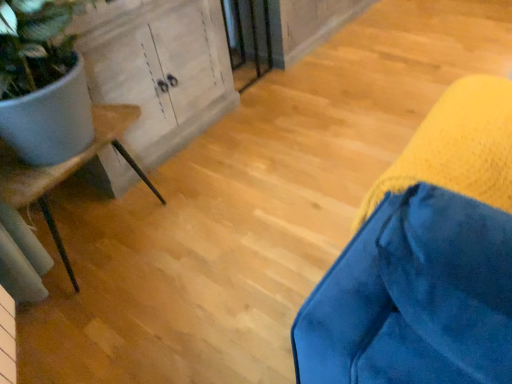
Image resolution: width=512 pixels, height=384 pixels. In order to click on vacant space underneath wooden screen door at center (from a real-world perspective) in this screenshot , I will do `click(246, 73)`.